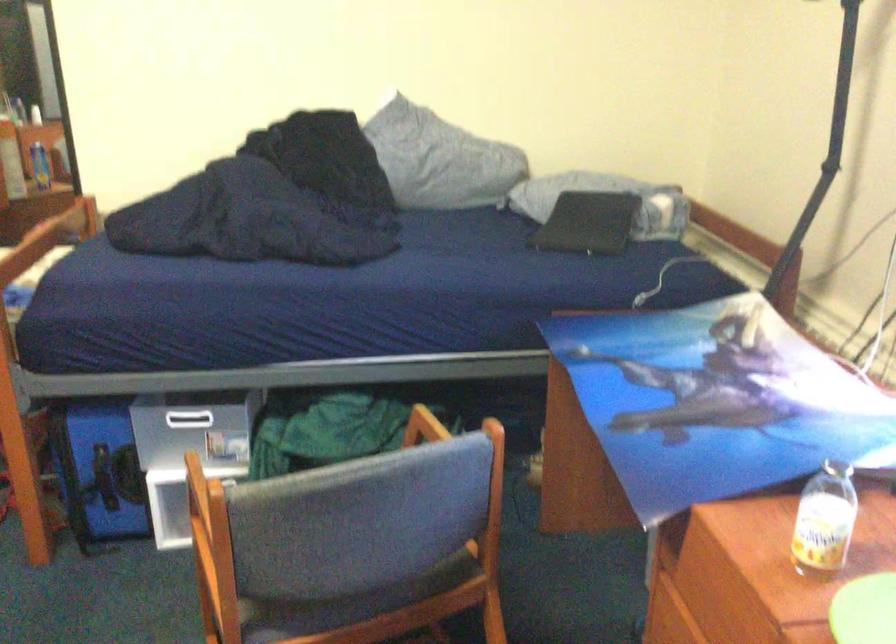
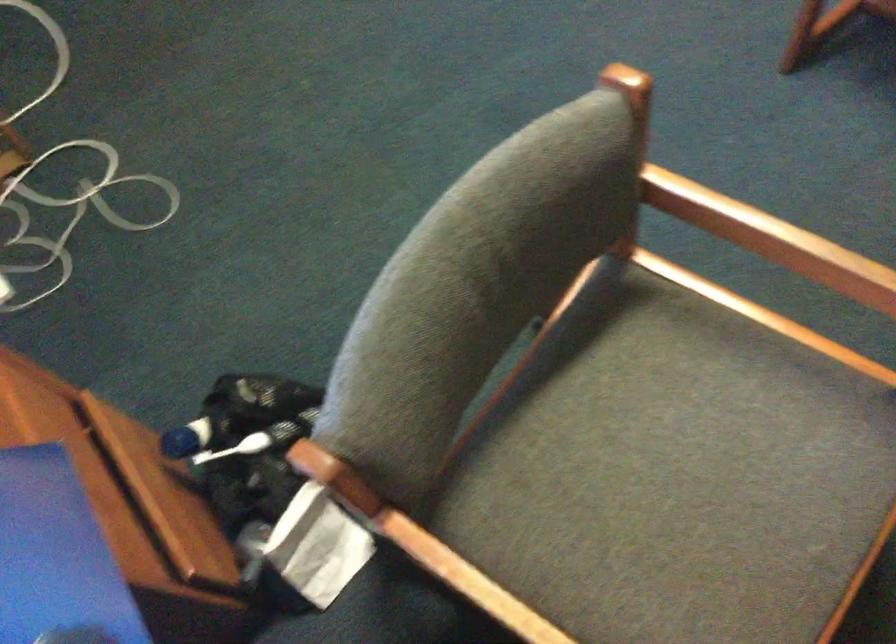
Find the pixel in the second image that matches point 330,571 in the first image.

(643, 444)